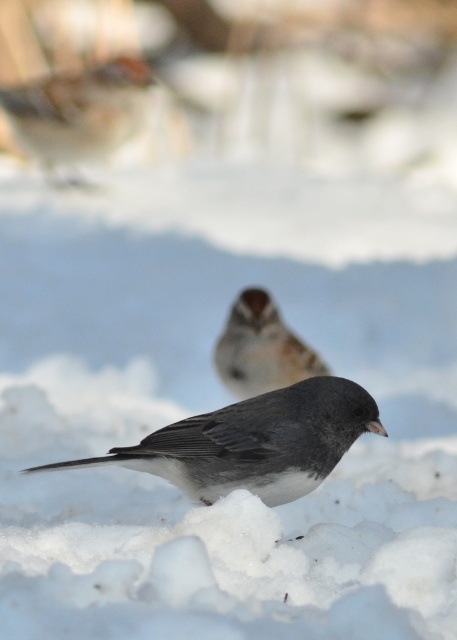
Question: In this image, where is brown speckled feathers at upper left located relative to brown speckled sparrow at center?

Choices:
 (A) above
 (B) below

Answer: (A)

Question: Can you confirm if dark gray matte bird at center is positioned to the right of brown speckled sparrow at center?

Choices:
 (A) no
 (B) yes

Answer: (A)

Question: Considering the real-world distances, which object is farthest from the dark gray matte bird at center?

Choices:
 (A) brown speckled sparrow at center
 (B) brown speckled feathers at upper left

Answer: (B)

Question: Does dark gray matte bird at center come behind brown speckled sparrow at center?

Choices:
 (A) no
 (B) yes

Answer: (A)

Question: Which point appears farthest from the camera in this image?

Choices:
 (A) (73, 80)
 (B) (291, 364)
 (C) (271, 433)

Answer: (A)

Question: Among these points, which one is nearest to the camera?

Choices:
 (A) (245, 390)
 (B) (308, 401)

Answer: (B)